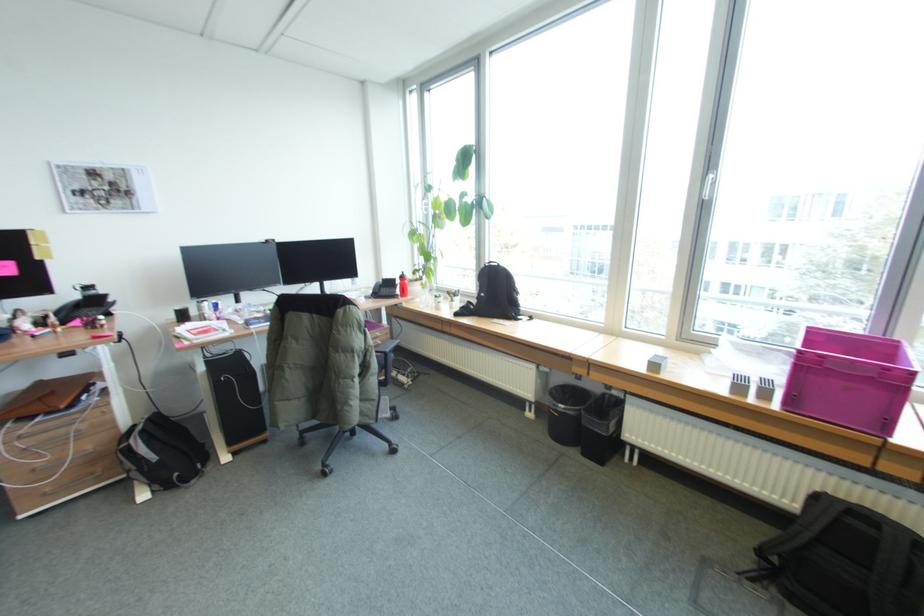
Image resolution: width=924 pixels, height=616 pixels. What are the coordinates of `drawer handle cutout` in the screenshot? It's located at (74, 484).